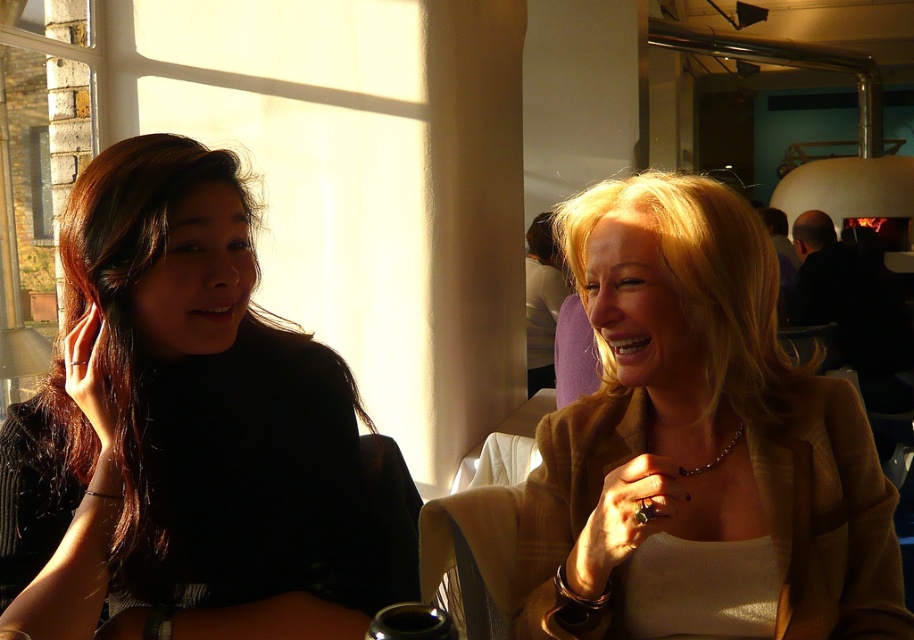
Question: Is black matte shirt at left further to camera compared to matte gold blazer at center?

Choices:
 (A) no
 (B) yes

Answer: (A)

Question: In this image, where is black matte shirt at left located relative to matte gold blazer at center?

Choices:
 (A) above
 (B) below

Answer: (B)

Question: Among these points, which one is nearest to the camera?

Choices:
 (A) (764, 378)
 (B) (192, 305)

Answer: (B)

Question: From the image, what is the correct spatial relationship of black matte shirt at left in relation to matte gold blazer at center?

Choices:
 (A) left
 (B) right

Answer: (A)

Question: Among these points, which one is nearest to the camera?

Choices:
 (A) (80, 625)
 (B) (796, 493)

Answer: (A)